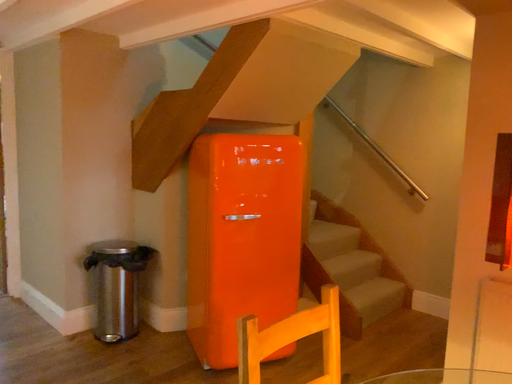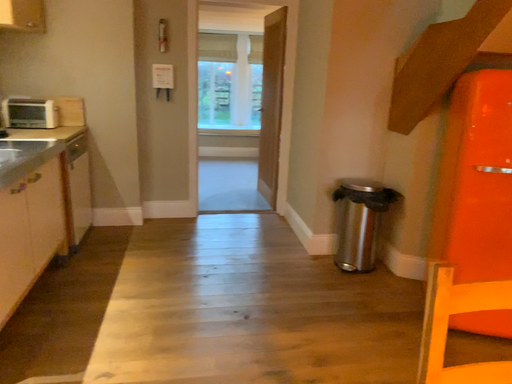
Question: How did the camera likely rotate when shooting the video?

Choices:
 (A) rotated left
 (B) rotated right

Answer: (A)